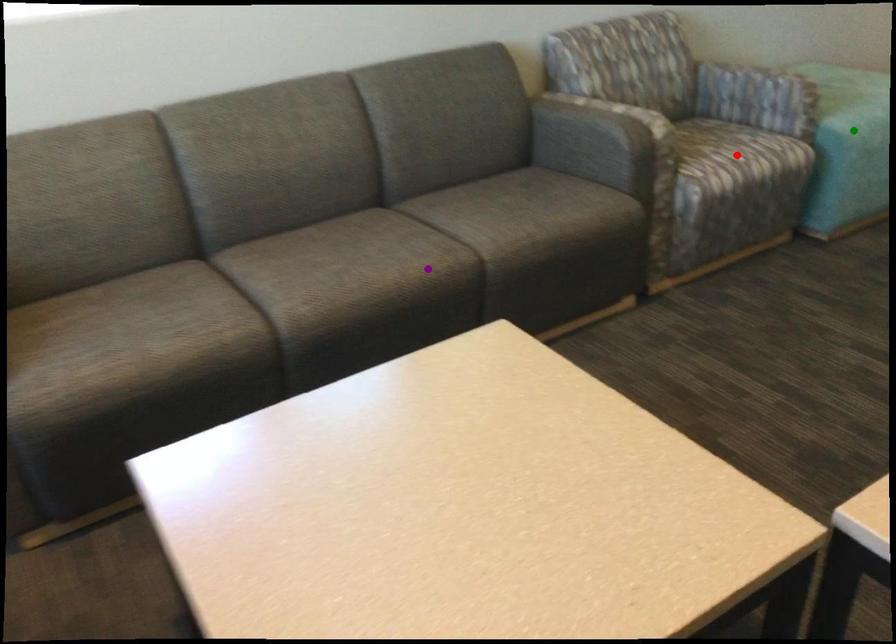
Order these from nearest to farthest:
purple point | red point | green point

purple point → red point → green point